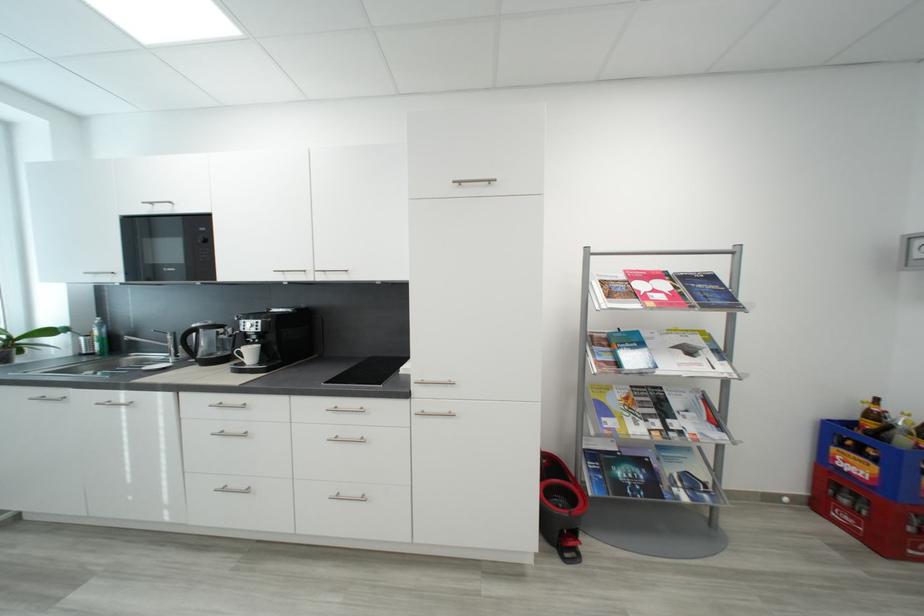
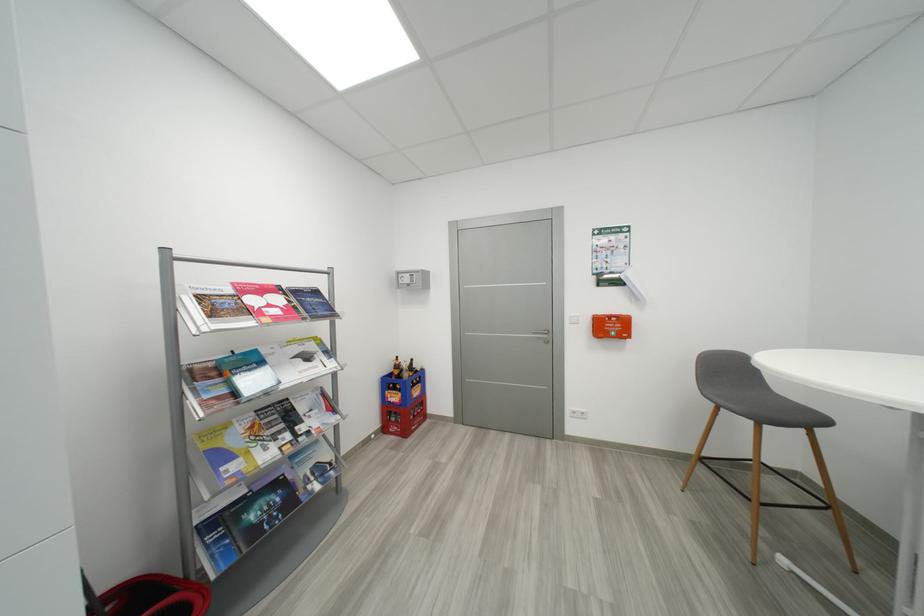
Find the pixel in the second image that matches (857,426) in the first image.

(397, 377)